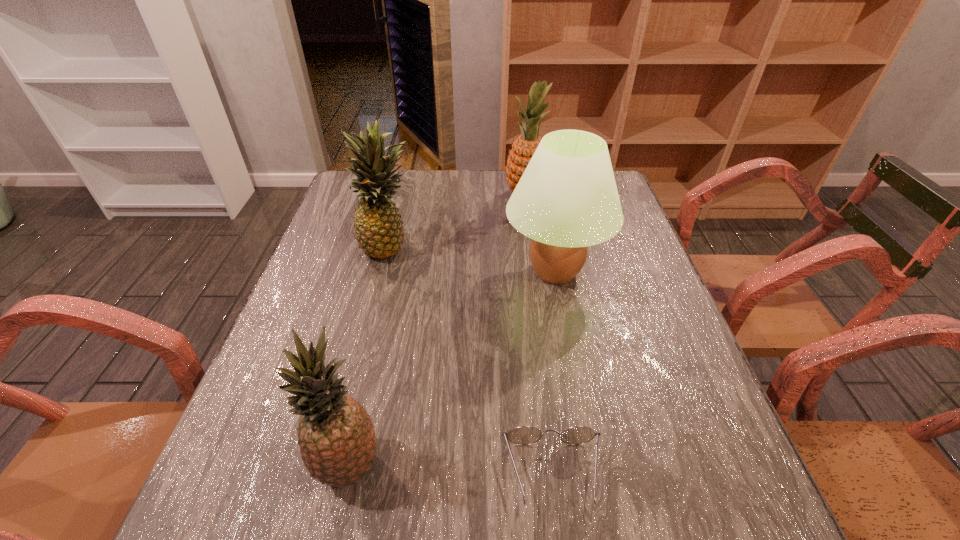
Identify the location of vacant space located on the front of the second farthest pineapple. (358, 376).

You are a GUI agent. You are given a task and a screenshot of the screen. Output one action in this format:
    pyautogui.click(x=<x>, y=<y>)
    Task: Click on the vacant space located on the right of the nearest pineapple
    The height and width of the screenshot is (540, 960).
    Given the screenshot: What is the action you would take?
    coord(506,466)

This screenshot has height=540, width=960. I want to click on object present at the far edge, so click(x=523, y=148).

You are a GUI agent. You are given a task and a screenshot of the screen. Output one action in this format:
    pyautogui.click(x=<x>, y=<y>)
    Task: Click on the pineapple situated at the near edge
    
    Given the screenshot: What is the action you would take?
    coord(337,440)

You are a GUI agent. You are given a task and a screenshot of the screen. Output one action in this format:
    pyautogui.click(x=<x>, y=<y>)
    Task: Click on the spectacles situated at the near edge
    The image size is (960, 540).
    Given the screenshot: What is the action you would take?
    pyautogui.click(x=524, y=435)

Locate an element on the screen. object that is at the right edge is located at coordinates pos(567,199).

Locate an element on the screen. The width and height of the screenshot is (960, 540). object that is at the near left corner is located at coordinates (337, 440).

Identify the location of vacant region at the far edge of the desktop. (417, 208).

The image size is (960, 540). Find the location of `free space at the near edge`. free space at the near edge is located at coordinates (431, 512).

Where is `free point at the left edge`? free point at the left edge is located at coordinates (345, 281).